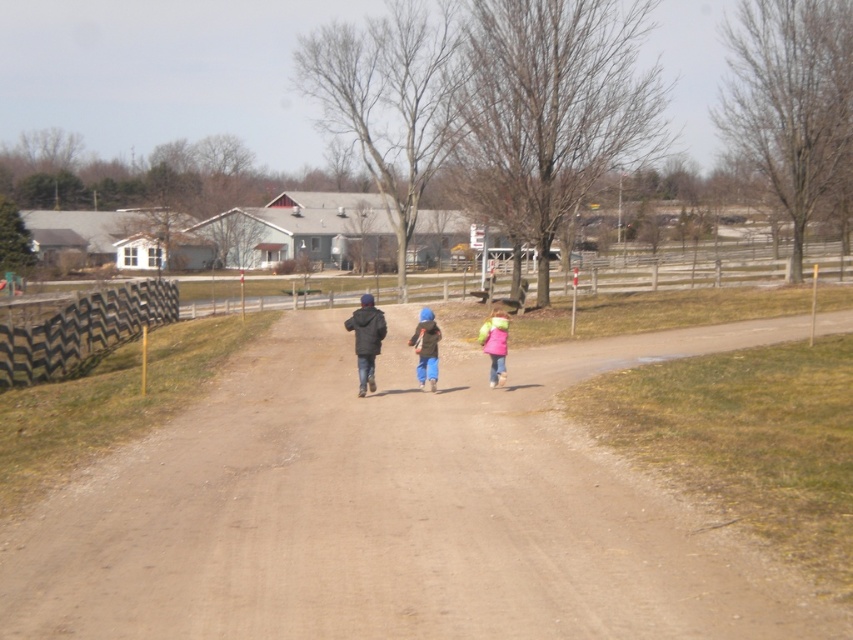
You are a photographer trying to capture the children walking on the dirt path. Based on the scene, can you determine if the blue denim pants at center are touching the brown dirt track at center?

The brown dirt track at center is positioned under blue denim pants at center, so yes, the blue denim pants at center are touching the brown dirt track at center.

You are a photographer standing on the dirt path and want to take a photo of the blue denim pants at center and the pink fleece jacket at center. The minimum distance required between subjects for your camera to focus properly is 4 feet. Will the camera be able to focus on both subjects?

The blue denim pants at center and pink fleece jacket at center are 3.97 feet apart, which is slightly less than the required 4 feet. Therefore, the camera may have difficulty focusing on both subjects due to the insufficient distance between them.

You are a photographer trying to capture a photo of the blue denim pants at center and the pink fleece jacket at center. Since you want to ensure both are clearly visible in the frame, which object should you focus on first considering their sizes?

The blue denim pants at center has a smaller size compared to the pink fleece jacket at center, so you should focus on the blue denim pants at center first to ensure its details are captured clearly before adjusting for the larger object.